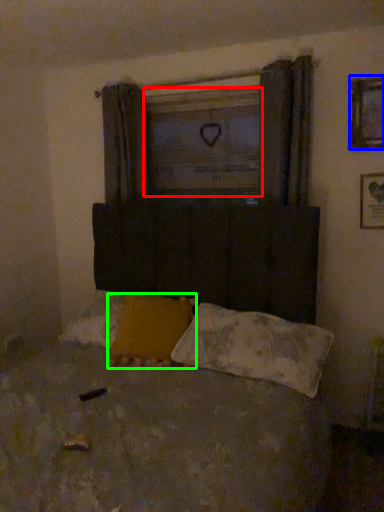
Question: Which is nearer to the window screen (highlighted by a red box)? picture frame (highlighted by a blue box) or pillow (highlighted by a green box).

Choices:
 (A) picture frame
 (B) pillow

Answer: (A)